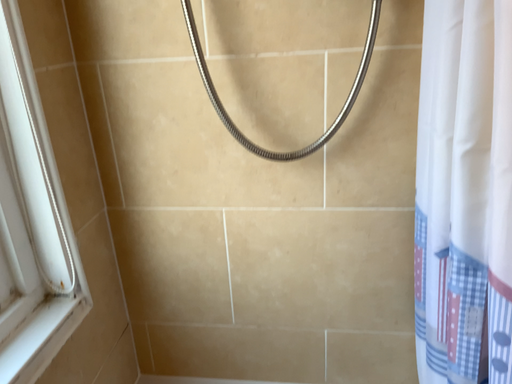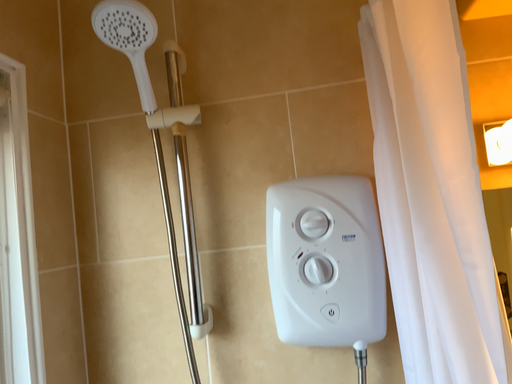
Question: How did the camera likely rotate when shooting the video?

Choices:
 (A) rotated downward
 (B) rotated upward

Answer: (B)